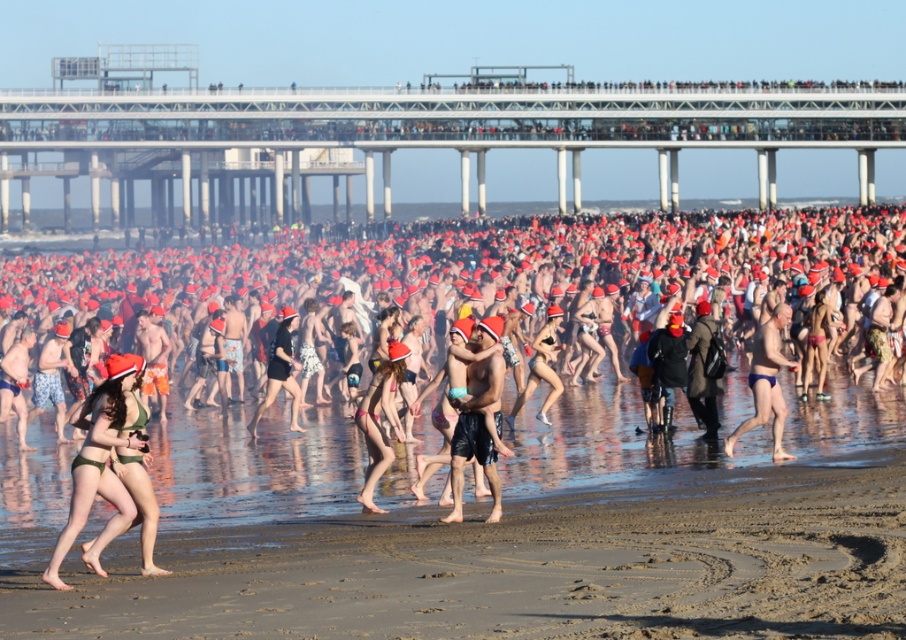
Question: Is blue matte swim trunks at center below black matte swimsuit at center?

Choices:
 (A) yes
 (B) no

Answer: (B)

Question: Which point is farther to the camera?

Choices:
 (A) (497, 396)
 (B) (288, 374)
 (C) (782, 420)

Answer: (B)

Question: Does matte black shorts at center have a larger size compared to blue matte swim trunks at center?

Choices:
 (A) yes
 (B) no

Answer: (B)

Question: Observing the image, what is the correct spatial positioning of matte black shorts at center in reference to blue matte swim trunks at center?

Choices:
 (A) left
 (B) right

Answer: (A)

Question: Estimate the real-world distances between objects in this image. Which object is closer to the blue matte swim trunks at center?

Choices:
 (A) green bikini at lower left
 (B) smooth sand heart at lower center
 (C) pink matte bikini bottom at center
 (D) black matte swimsuit at center

Answer: (C)

Question: Which of the following is the farthest from the observer?

Choices:
 (A) (459, 454)
 (B) (278, 364)
 (C) (56, 557)
 (D) (378, 465)

Answer: (B)